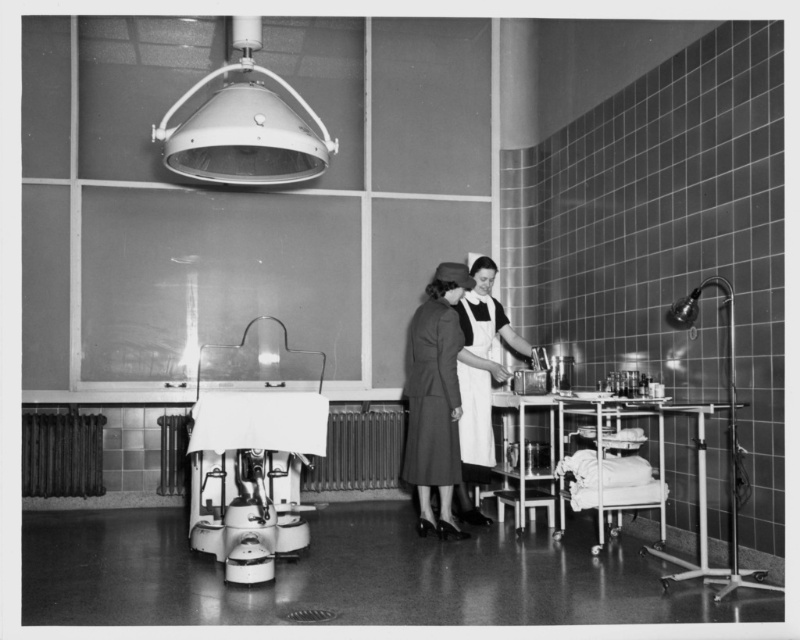
Is white fabric-covered bed at lower right positioned in front of white cotton apron at center?

That is True.

Who is positioned more to the left, white fabric-covered bed at lower right or white cotton apron at center?

Positioned to the left is white cotton apron at center.

Locate an element on the screen. This screenshot has height=640, width=800. white fabric-covered bed at lower right is located at coordinates (613, 449).

Is point (270, 545) positioned before point (476, 296)?

Yes, point (270, 545) is in front of point (476, 296).

Between metallic gray machine at center and white cotton apron at center, which one appears on the right side from the viewer's perspective?

white cotton apron at center is more to the right.

Locate an element on the screen. metallic gray machine at center is located at coordinates (254, 451).

You are a GUI agent. You are given a task and a screenshot of the screen. Output one action in this format:
    pyautogui.click(x=<x>, y=<y>)
    Task: Click on the metallic gray machine at center
    This screenshot has width=800, height=640.
    Given the screenshot: What is the action you would take?
    pyautogui.click(x=254, y=451)

In the scene shown: Is white apron at center taller than white cotton apron at center?

Yes, white apron at center is taller than white cotton apron at center.

Does white apron at center appear over white cotton apron at center?

No.

Does point (512, 340) come in front of point (478, 305)?

That is False.

Image resolution: width=800 pixels, height=640 pixels. In order to click on white apron at center in this screenshot , I will do `click(480, 380)`.